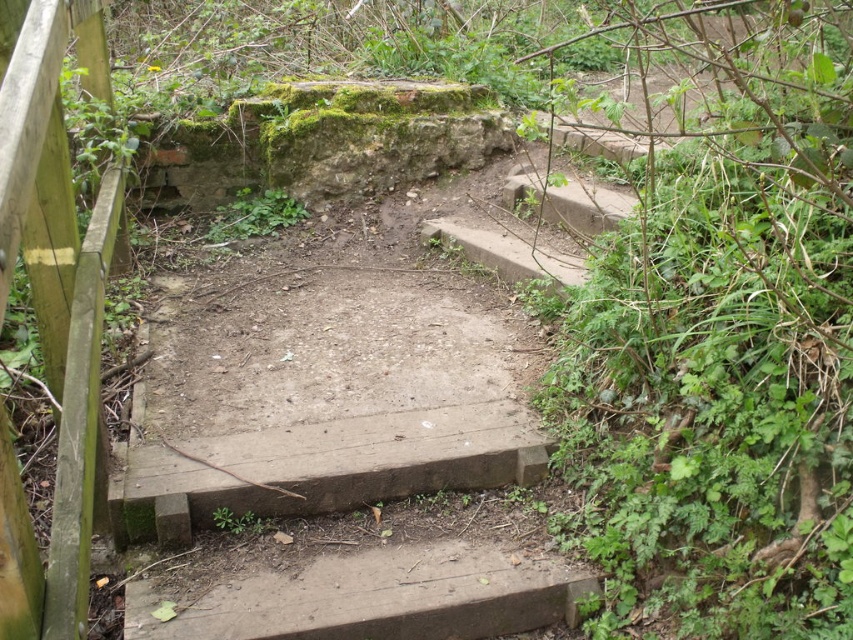
Question: From the image, what is the correct spatial relationship of green leafy plant at upper right in relation to wooden fence at left?

Choices:
 (A) left
 (B) right

Answer: (B)

Question: Among these points, which one is farthest from the camera?

Choices:
 (A) (48, 321)
 (B) (822, 444)

Answer: (A)

Question: Among these points, which one is nearest to the camera?

Choices:
 (A) (801, 54)
 (B) (15, 256)

Answer: (B)

Question: Is green leafy plant at upper right closer to the viewer compared to wooden fence at left?

Choices:
 (A) no
 (B) yes

Answer: (A)

Question: Which point appears closest to the camera in this image?

Choices:
 (A) (74, 372)
 (B) (761, 106)

Answer: (B)

Question: Is the position of green leafy plant at upper right less distant than that of wooden fence at left?

Choices:
 (A) no
 (B) yes

Answer: (A)